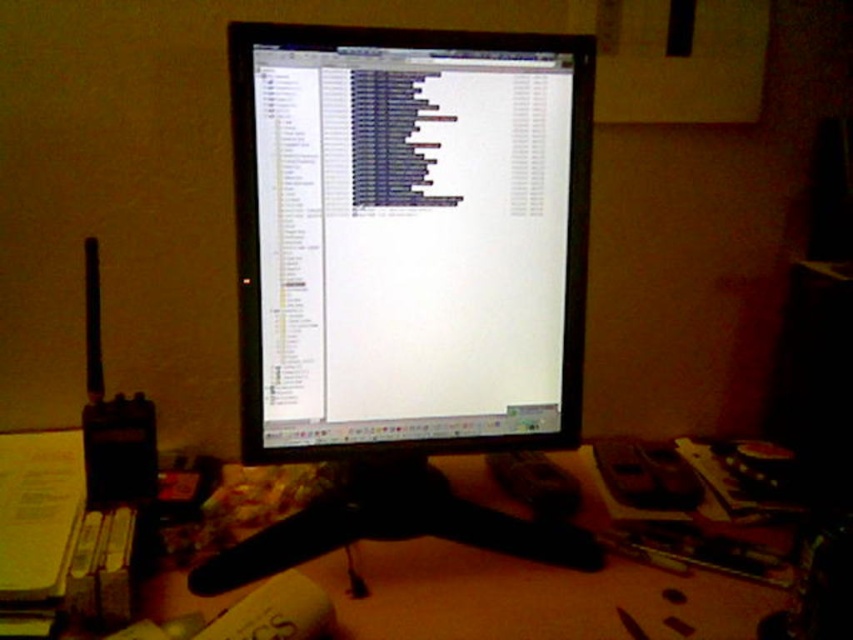
Question: Does matte black monitor at center appear under wooden at center?

Choices:
 (A) yes
 (B) no

Answer: (B)

Question: In this image, where is matte black monitor at center located relative to wooden at center?

Choices:
 (A) left
 (B) right

Answer: (B)

Question: Does matte black monitor at center appear on the right side of wooden at center?

Choices:
 (A) no
 (B) yes

Answer: (B)

Question: Which point is farther from the camera taking this photo?

Choices:
 (A) (566, 364)
 (B) (467, 592)

Answer: (A)